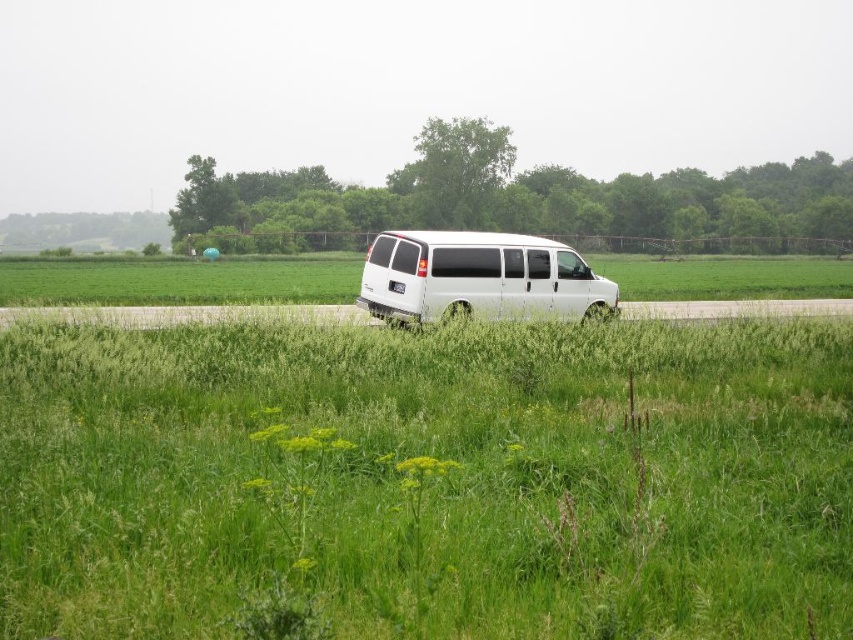
Question: Is green grassy at center above white matte van at center?

Choices:
 (A) yes
 (B) no

Answer: (B)

Question: Is green grassy at center thinner than white matte van at center?

Choices:
 (A) no
 (B) yes

Answer: (A)

Question: Can you confirm if green grassy at center is wider than white matte van at center?

Choices:
 (A) no
 (B) yes

Answer: (B)